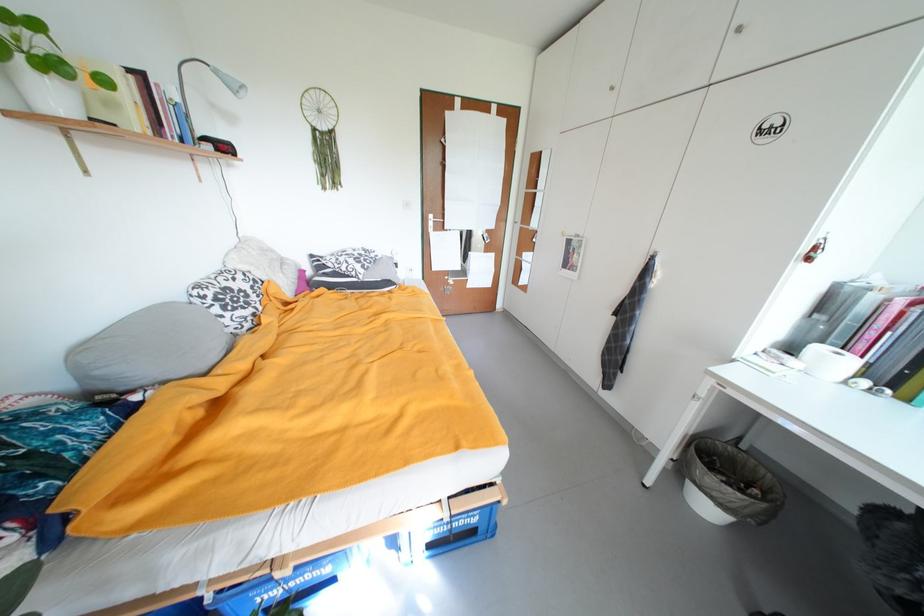
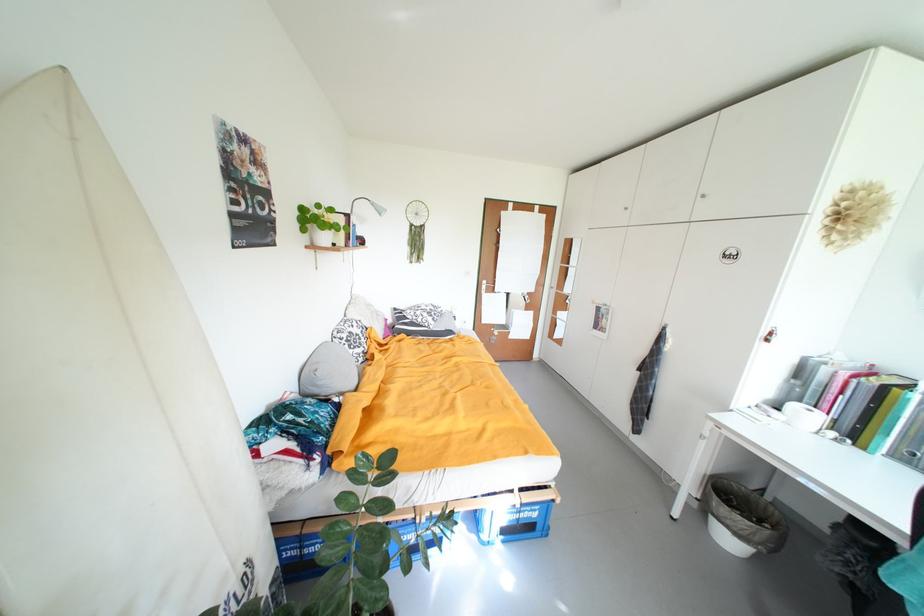
Find the pixel in the second image that matches (x=714, y=509) in the first image.

(736, 544)